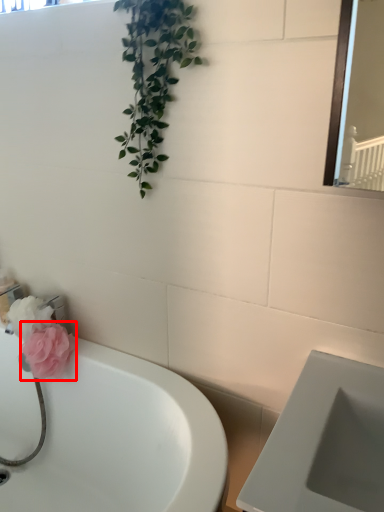
Question: From the image's perspective, where is flower (annotated by the red box) located relative to bathtub?

Choices:
 (A) below
 (B) above

Answer: (B)